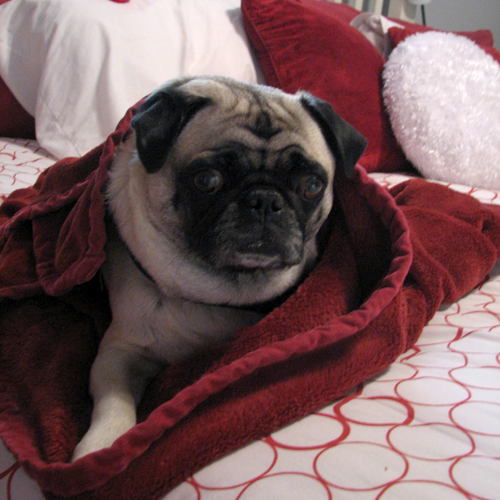
I want to click on blanket, so click(x=364, y=288).